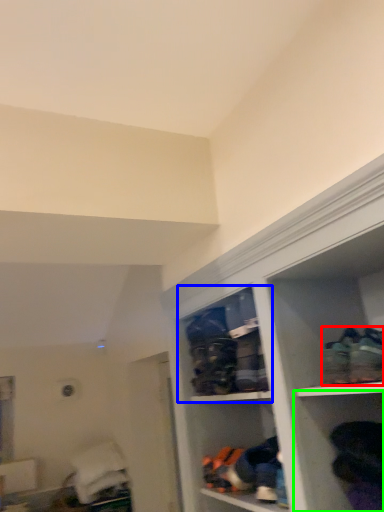
Question: Which object is the closest to the footwear (highlighted by a red box)? Choose among these: cabinet (highlighted by a blue box) or shelf (highlighted by a green box).

Choices:
 (A) cabinet
 (B) shelf

Answer: (B)